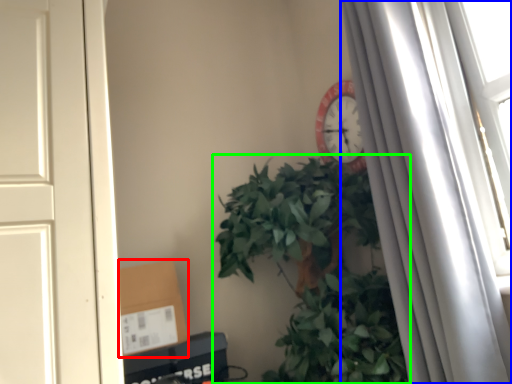
Question: Estimate the real-world distances between objects in this image. Which object is farther from cardboard box (highlighted by a red box), curtain (highlighted by a blue box) or houseplant (highlighted by a green box)?

Choices:
 (A) curtain
 (B) houseplant

Answer: (A)